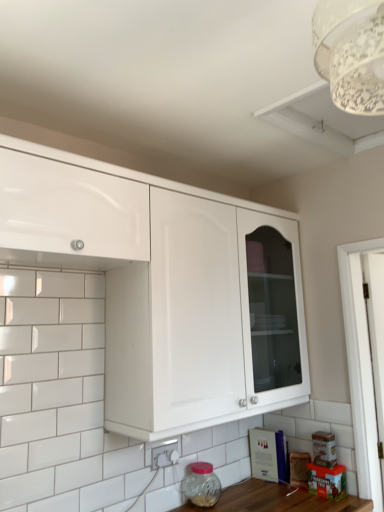
Question: Does transparent glass jar at lower center have a lesser width compared to white glossy cabinet at upper center, which appears as the first cabinetry when viewed from the right?

Choices:
 (A) no
 (B) yes

Answer: (B)

Question: From a real-world perspective, is transparent glass jar at lower center beneath white glossy cabinet at upper center, placed as the second cabinetry when sorted from left to right?

Choices:
 (A) no
 (B) yes

Answer: (B)

Question: Considering the relative positions of transparent glass jar at lower center and white glossy cabinet at upper center, placed as the second cabinetry when sorted from left to right, in the image provided, is transparent glass jar at lower center behind white glossy cabinet at upper center, placed as the second cabinetry when sorted from left to right,?

Choices:
 (A) yes
 (B) no

Answer: (A)

Question: Does transparent glass jar at lower center turn towards white glossy cabinet at upper center, placed as the second cabinetry when sorted from left to right?

Choices:
 (A) no
 (B) yes

Answer: (A)

Question: Can you confirm if transparent glass jar at lower center is bigger than white glossy cabinet at upper center, which appears as the first cabinetry when viewed from the right?

Choices:
 (A) no
 (B) yes

Answer: (A)

Question: Is point (195, 489) closer or farther from the camera than point (178, 448)?

Choices:
 (A) closer
 (B) farther

Answer: (B)

Question: From the image's perspective, is transparent glass jar at lower center above or below white glossy electric outlet at lower center?

Choices:
 (A) above
 (B) below

Answer: (B)

Question: Considering the relative positions of transparent glass jar at lower center and white glossy electric outlet at lower center in the image provided, is transparent glass jar at lower center to the left or to the right of white glossy electric outlet at lower center?

Choices:
 (A) right
 (B) left

Answer: (A)

Question: Based on their sizes in the image, would you say transparent glass jar at lower center is bigger or smaller than white glossy electric outlet at lower center?

Choices:
 (A) big
 (B) small

Answer: (A)

Question: Is point (44, 216) positioned closer to the camera than point (380, 33)?

Choices:
 (A) farther
 (B) closer

Answer: (A)

Question: In terms of height, does white glossy cabinet at upper left, acting as the 2th cabinetry starting from the right, look taller or shorter compared to white lace lampshade at upper right?

Choices:
 (A) tall
 (B) short

Answer: (A)

Question: In terms of size, does white glossy cabinet at upper left, the first cabinetry positioned from the left, appear bigger or smaller than white lace lampshade at upper right?

Choices:
 (A) small
 (B) big

Answer: (B)

Question: From a real-world perspective, is white glossy cabinet at upper left, the first cabinetry positioned from the left, physically located above or below white lace lampshade at upper right?

Choices:
 (A) below
 (B) above

Answer: (A)

Question: Does point (192, 487) appear closer or farther from the camera than point (337, 46)?

Choices:
 (A) farther
 (B) closer

Answer: (A)

Question: In the image, is transparent glass jar at lower center on the left side or the right side of white lace lampshade at upper right?

Choices:
 (A) left
 (B) right

Answer: (A)